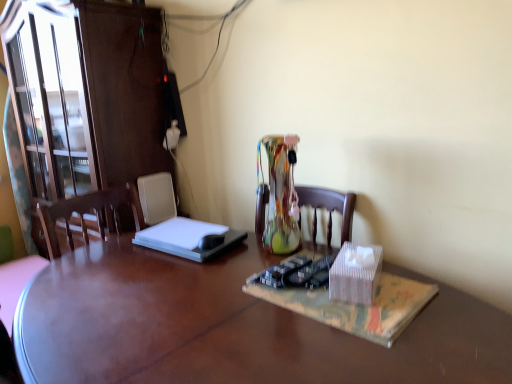
This screenshot has height=384, width=512. Identify the location of empty space that is ontop of wooden desk at center (from a real-world perspective). (219, 303).